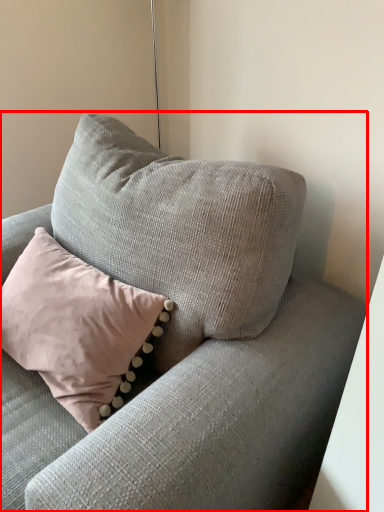
Question: From the image's perspective, where is studio couch (annotated by the red box) located relative to pillow?

Choices:
 (A) above
 (B) below

Answer: (B)